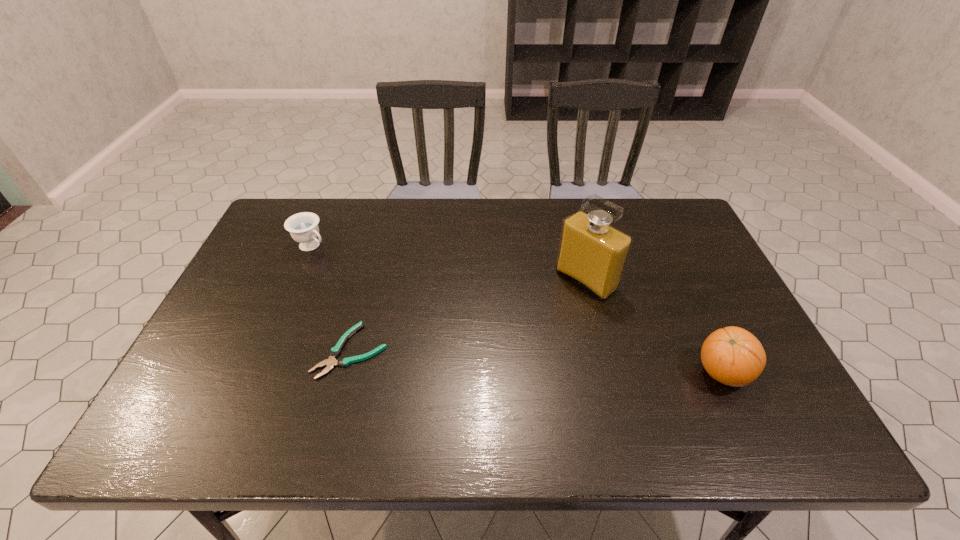
Where is `free space between the second object from right to left and the rightmost object`? The height and width of the screenshot is (540, 960). free space between the second object from right to left and the rightmost object is located at coordinates (655, 327).

Find the location of `vacant area between the third shortest object and the shortest object`. vacant area between the third shortest object and the shortest object is located at coordinates (537, 362).

The image size is (960, 540). In order to click on empty location between the third tallest object and the second tallest object in this screenshot , I will do `click(517, 309)`.

In order to click on vacant region between the leftmost object and the rightmost object in this screenshot , I will do `click(517, 309)`.

The width and height of the screenshot is (960, 540). In order to click on free space that is in between the pliers and the third nearest object in this screenshot , I will do `click(468, 315)`.

The image size is (960, 540). What are the coordinates of `vacant space in between the third object from left to right and the leftmost object` in the screenshot? It's located at (449, 263).

At what (x,y) coordinates should I click in order to perform the action: click on free point between the leftmost object and the rightmost object. Please return your answer as a coordinate pair (x, y). Image resolution: width=960 pixels, height=540 pixels. Looking at the image, I should click on (517, 309).

You are a GUI agent. You are given a task and a screenshot of the screen. Output one action in this format:
    pyautogui.click(x=<x>, y=<y>)
    Task: Click on the free spot between the pliers and the perfume
    This screenshot has width=960, height=540.
    Given the screenshot: What is the action you would take?
    pyautogui.click(x=468, y=315)

This screenshot has height=540, width=960. I want to click on the closest object to the shortest object, so point(303,227).

This screenshot has width=960, height=540. Identify the location of object that is the nearest to the farthest object. (336, 350).